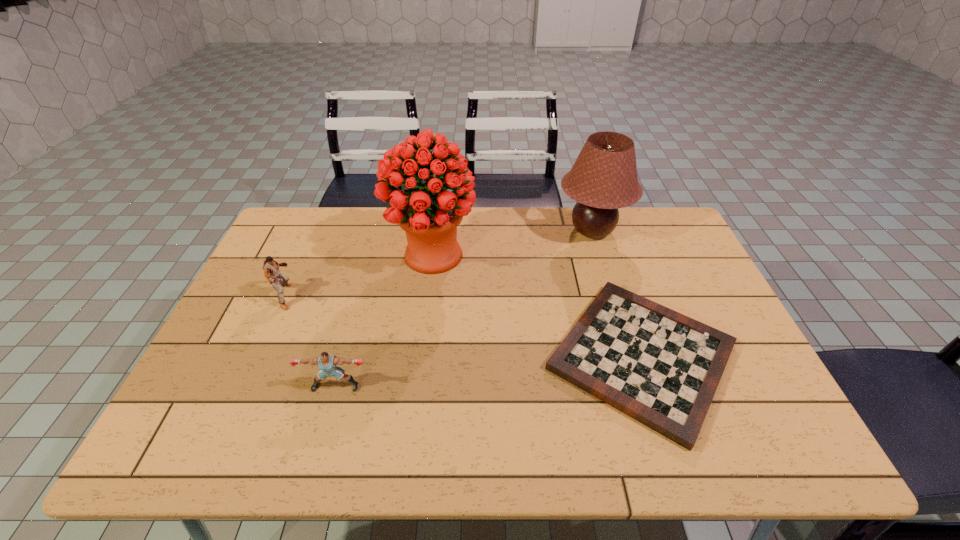
In the image, there is a desktop. What are the coordinates of `vacant space at the far edge` in the screenshot? It's located at (380, 211).

Locate an element on the screen. free point at the near edge is located at coordinates (713, 428).

In the image, there is a desktop. Identify the location of vacant region at the left edge. This screenshot has height=540, width=960. (217, 348).

In the image, there is a desktop. In order to click on free space at the far left corner in this screenshot , I will do click(x=316, y=213).

In the image, there is a desktop. Where is `vacant space at the near right corner`? Image resolution: width=960 pixels, height=540 pixels. vacant space at the near right corner is located at coordinates (804, 453).

Where is `free space between the chessboard and the left puncher`? free space between the chessboard and the left puncher is located at coordinates (464, 327).

The image size is (960, 540). I want to click on vacant space that is in between the nearer puncher and the second tallest object, so click(x=464, y=308).

Where is `free space between the fourth shortest object and the tallest object`? The height and width of the screenshot is (540, 960). free space between the fourth shortest object and the tallest object is located at coordinates (513, 243).

Where is `vacant space that's between the leftmost object and the shortest object`? vacant space that's between the leftmost object and the shortest object is located at coordinates (464, 327).

This screenshot has height=540, width=960. I want to click on free space that is in between the tallest object and the lampshade, so click(x=513, y=243).